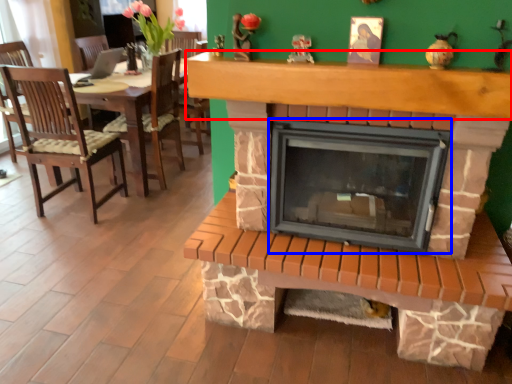
Question: Among these objects, which one is farthest to the camera, mantle (highlighted by a red box) or wood burning stove (highlighted by a blue box)?

Choices:
 (A) mantle
 (B) wood burning stove

Answer: (B)